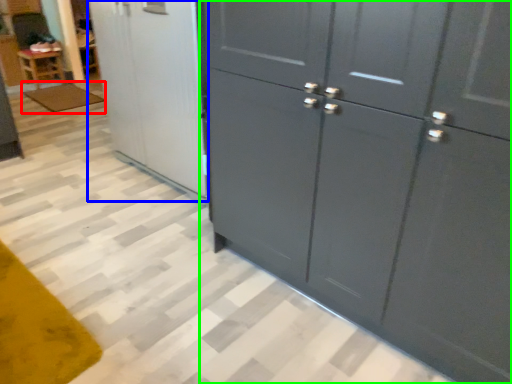
Question: Based on their relative distances, which object is farther from mat (highlighted by a red box)? Choose from screen door (highlighted by a blue box) and cupboard (highlighted by a green box).

Choices:
 (A) screen door
 (B) cupboard

Answer: (B)